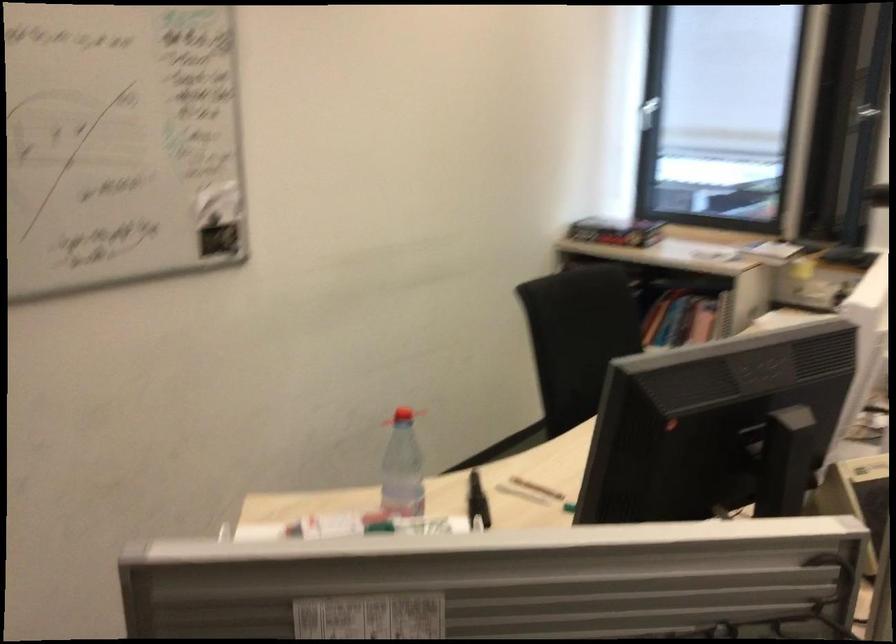
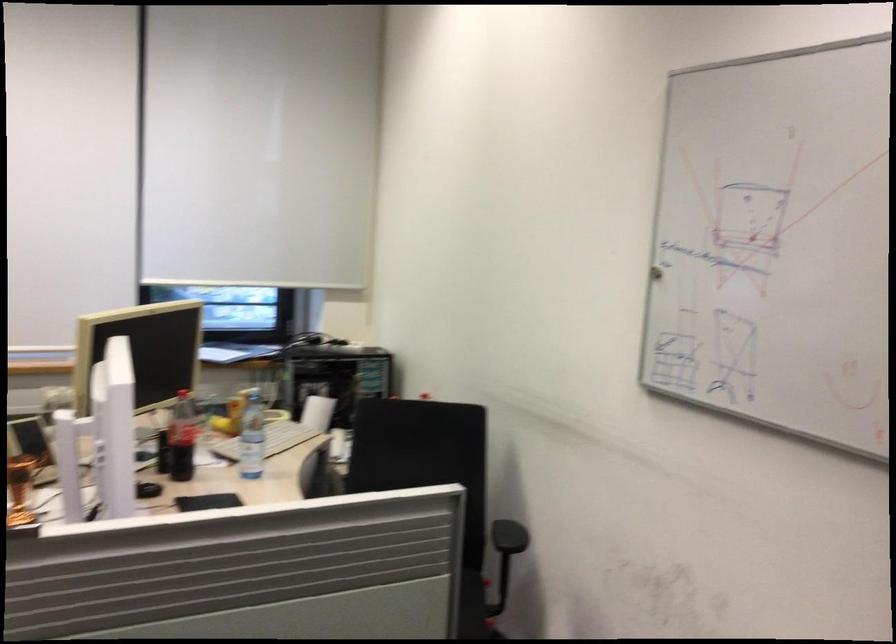
Question: The images are taken continuously from a first-person perspective. In which direction is your viewpoint rotating?

Choices:
 (A) Left
 (B) Right
 (C) Up
 (D) Down

Answer: (B)